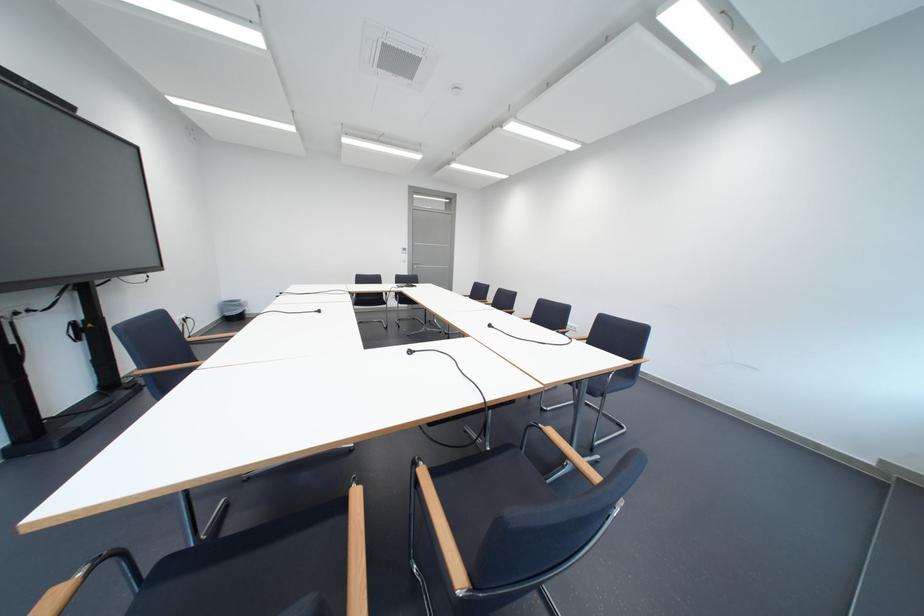
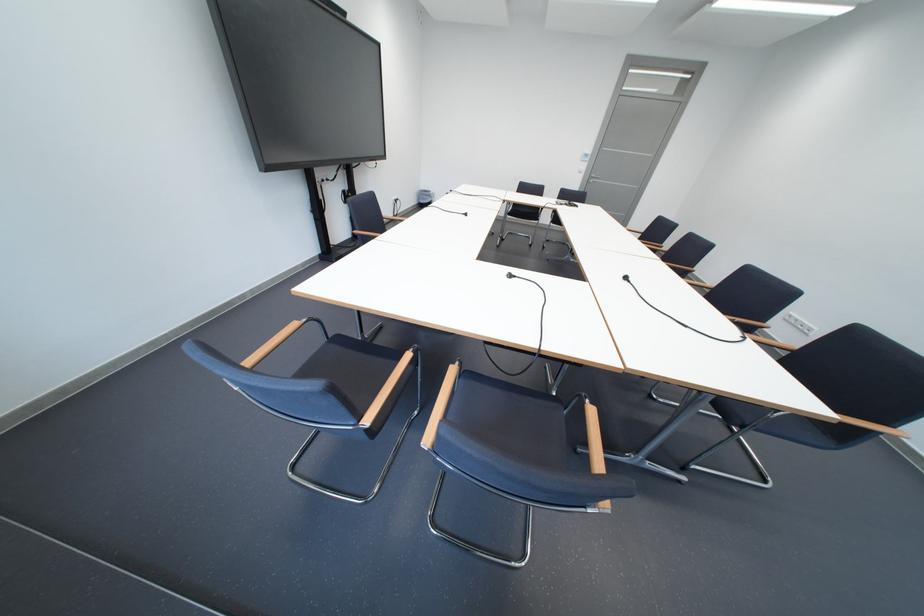
The point at (418, 259) is marked in the first image. Where is the corresponding point in the second image?

(596, 168)